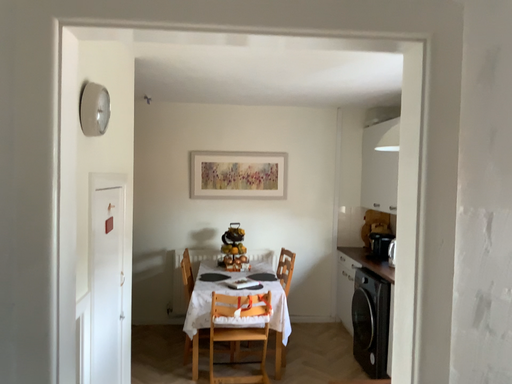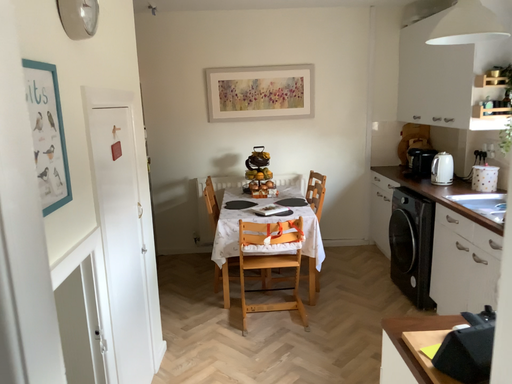
Question: How did the camera likely rotate when shooting the video?

Choices:
 (A) rotated upward
 (B) rotated downward

Answer: (B)